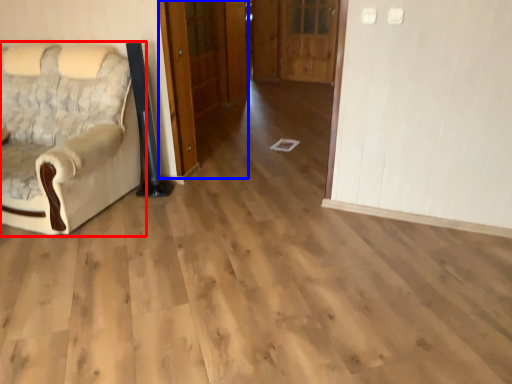
Question: Which object is closer to the camera taking this photo, chair (highlighted by a red box) or door (highlighted by a blue box)?

Choices:
 (A) chair
 (B) door

Answer: (A)